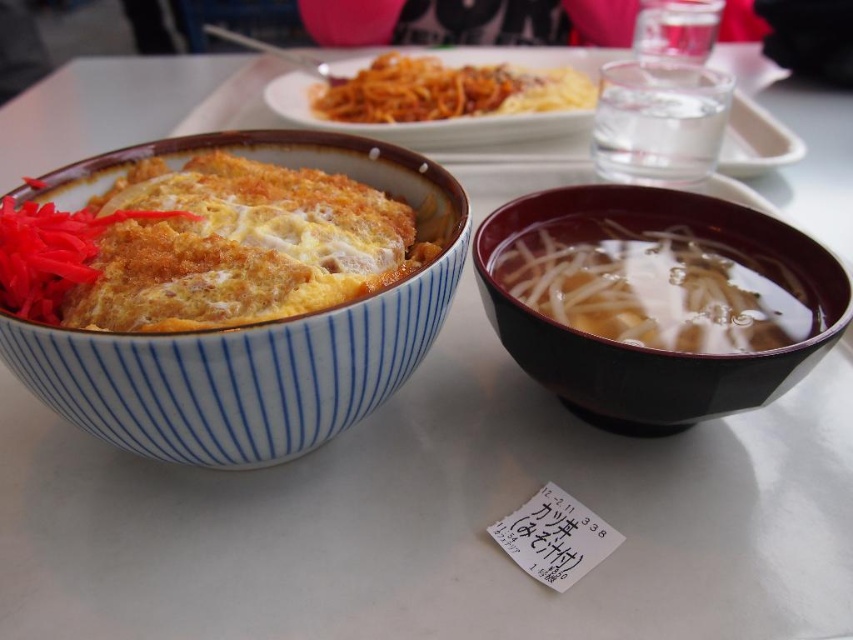
Who is lower down, black glossy bowl at right or blue striped bowl at left?

black glossy bowl at right is below.

Can you confirm if black glossy bowl at right is positioned above blue striped bowl at left?

Incorrect, black glossy bowl at right is not positioned above blue striped bowl at left.

Does point (683, 260) lie behind point (331, 358)?

Yes, point (683, 260) is behind point (331, 358).

At what (x,y) coordinates should I click in order to perform the action: click on black glossy bowl at right. Please return your answer as a coordinate pair (x, y). Looking at the image, I should click on (656, 301).

Between point (646, 285) and point (540, 77), which one is positioned in front?

Point (646, 285) is in front.

The height and width of the screenshot is (640, 853). I want to click on black glossy bowl at right, so click(x=656, y=301).

Image resolution: width=853 pixels, height=640 pixels. What do you see at coordinates (656, 301) in the screenshot?
I see `black glossy bowl at right` at bounding box center [656, 301].

Does black glossy bowl at right have a lesser width compared to translucent broth at right?

Incorrect, black glossy bowl at right's width is not less than translucent broth at right's.

Does point (643, 403) come behind point (682, 310)?

No, (643, 403) is closer to viewer.

The width and height of the screenshot is (853, 640). In order to click on black glossy bowl at right in this screenshot , I will do `click(656, 301)`.